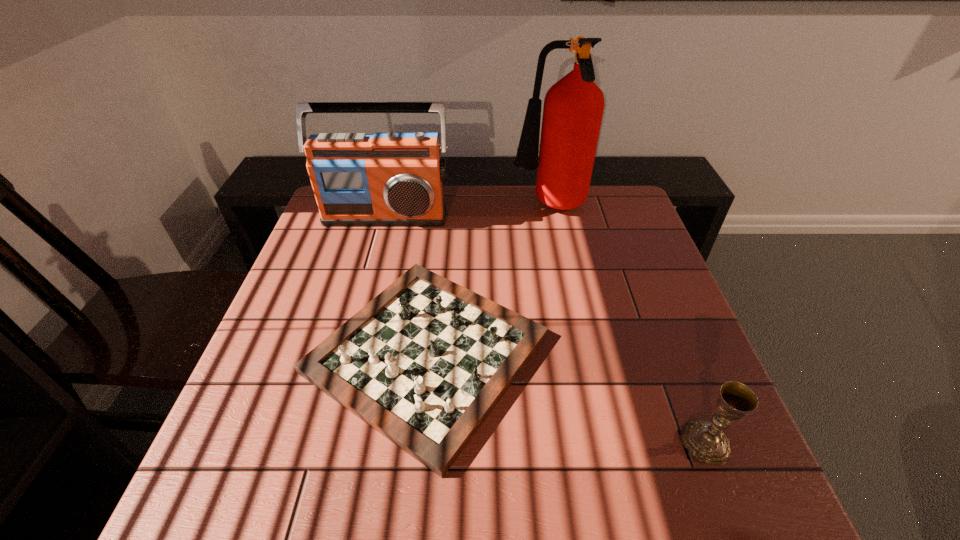
You are a GUI agent. You are given a task and a screenshot of the screen. Output one action in this format:
    pyautogui.click(x=<x>, y=<y>)
    Task: Click on the fire extinguisher
    
    Given the screenshot: What is the action you would take?
    pyautogui.click(x=573, y=108)

Identify the location of radio receiver. This screenshot has width=960, height=540. (383, 179).

This screenshot has height=540, width=960. I want to click on chalice, so click(705, 440).

I want to click on the third tallest object, so click(x=705, y=440).

Image resolution: width=960 pixels, height=540 pixels. I want to click on the shortest object, so click(x=424, y=363).

This screenshot has width=960, height=540. Find the location of `vacant space located at the nozzle of the tallest object`. vacant space located at the nozzle of the tallest object is located at coordinates (455, 207).

Find the location of a particular element. Image resolution: width=960 pixels, height=540 pixels. free space located 0.160m at the nozzle of the tallest object is located at coordinates (462, 207).

This screenshot has width=960, height=540. Find the location of `vacant space located 0.330m at the nozzle of the tallest object`. vacant space located 0.330m at the nozzle of the tallest object is located at coordinates (408, 207).

Find the location of a particular element. The image size is (960, 540). vacant space located 0.350m on the front-facing side of the radio receiver is located at coordinates (358, 316).

You are a GUI agent. You are given a task and a screenshot of the screen. Output one action in this format:
    pyautogui.click(x=<x>, y=<y>)
    Task: Click on the free space located on the back of the rightmost object
    This screenshot has height=540, width=960.
    Given the screenshot: What is the action you would take?
    pyautogui.click(x=675, y=365)